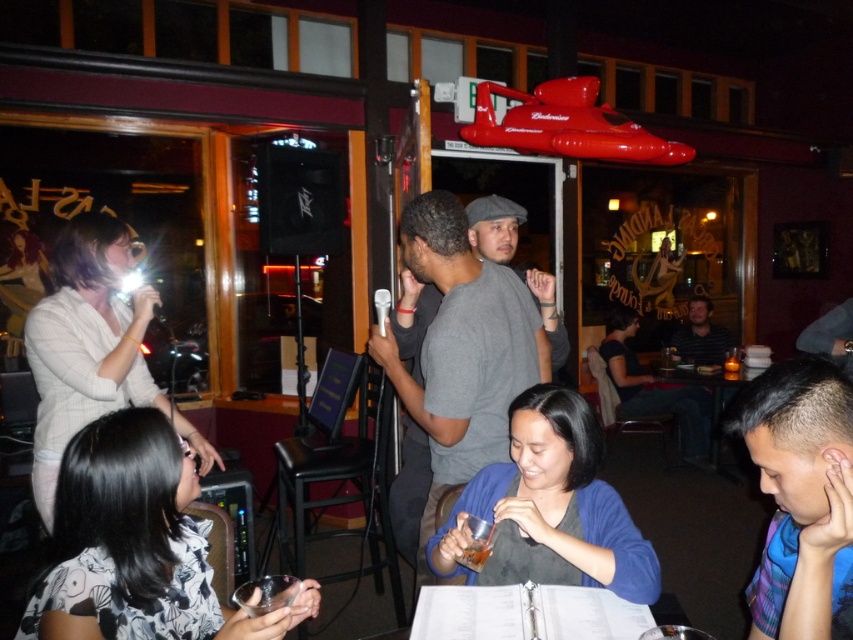
You are a bartender preparing to serve a drink. You notice the striped shirt at center and the translucent glass cup at center on the table. Which object should you avoid pouring liquid into to prevent spillage?

You should avoid pouring liquid into the striped shirt at center because it has a larger size compared to the translucent glass cup at center, making it more prone to spills if used as a container.

You are a photographer taking a picture of the striped shirt at center and the translucent glass beverage at center. Which object should you focus on first to ensure both are in sharp focus?

You should focus on the striped shirt at center first because it is closer to you than the translucent glass beverage at center, so adjusting focus from near to far will help both be in sharp focus.

You are standing at the camera position and want to reach the striped shirt at center. The maximum distance you can walk is 15 feet. Can you reach it?

The striped shirt at center is 17.04 feet away from the camera, which is beyond your maximum walking distance of 15 feet. Therefore, you cannot reach it.